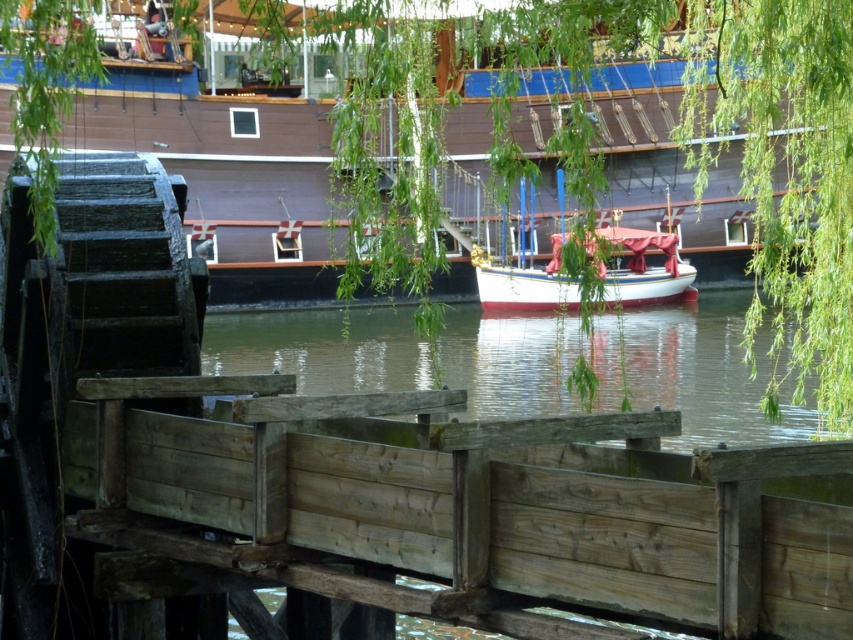
Does wooden ship at upper center appear over white glossy boat at center?

Yes, wooden ship at upper center is above white glossy boat at center.

Between wooden ship at upper center and white glossy boat at center, which one appears on the left side from the viewer's perspective?

wooden ship at upper center

Image resolution: width=853 pixels, height=640 pixels. I want to click on wooden ship at upper center, so click(x=718, y=109).

Who is more distant from viewer, (583, 538) or (538, 3)?

Point (538, 3)

Is weathered wood dock at lower center taller than wooden ship at upper center?

No.

The width and height of the screenshot is (853, 640). What do you see at coordinates (471, 504) in the screenshot?
I see `weathered wood dock at lower center` at bounding box center [471, 504].

I want to click on weathered wood dock at lower center, so pyautogui.click(x=471, y=504).

Locate an element on the screen. The image size is (853, 640). weathered wood dock at lower center is located at coordinates (471, 504).